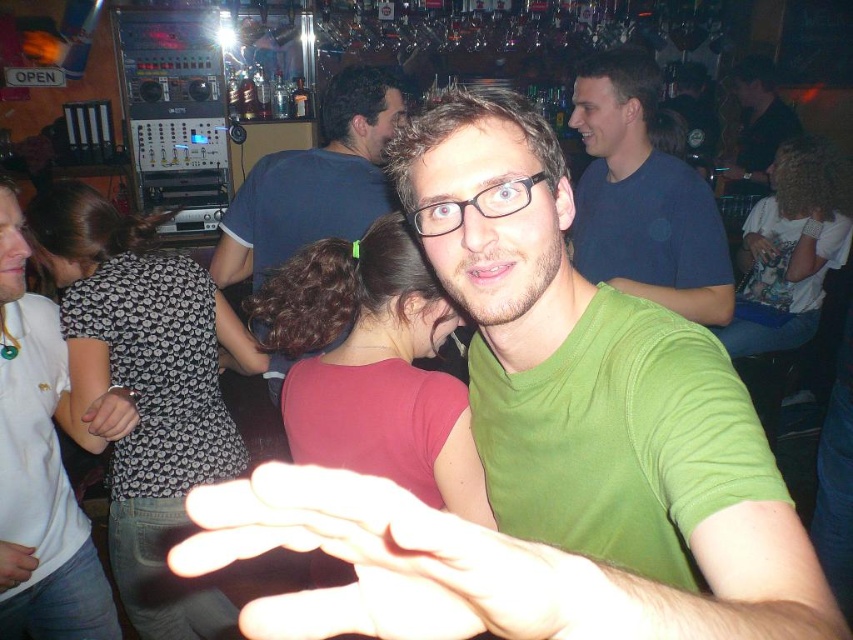
Does white dotted shirt at left have a greater height compared to green matte shirt at upper right?

Yes.

Is white dotted shirt at left smaller than green matte shirt at upper right?

Yes.

At what (x,y) coordinates should I click in order to perform the action: click on white dotted shirt at left. Please return your answer as a coordinate pair (x, y). The image size is (853, 640). Looking at the image, I should click on (39, 461).

In order to click on white dotted shirt at left in this screenshot , I will do `click(39, 461)`.

Can you confirm if white dotted shirt at left is positioned above light skin hand at center?

Indeed, white dotted shirt at left is positioned over light skin hand at center.

Does white dotted shirt at left have a larger size compared to light skin hand at center?

Correct, white dotted shirt at left is larger in size than light skin hand at center.

This screenshot has height=640, width=853. Describe the element at coordinates (39, 461) in the screenshot. I see `white dotted shirt at left` at that location.

Image resolution: width=853 pixels, height=640 pixels. In order to click on white dotted shirt at left in this screenshot , I will do `click(39, 461)`.

Between bright white flesh at center and blue cotton shirt at center, which one is positioned lower?

Positioned lower is bright white flesh at center.

Who is more distant from viewer, (358, 605) or (328, 93)?

The point (328, 93) is behind.

Who is more forward, (323, 497) or (241, 221)?

Point (323, 497) is in front.

Locate an element on the screen. The width and height of the screenshot is (853, 640). bright white flesh at center is located at coordinates (384, 563).